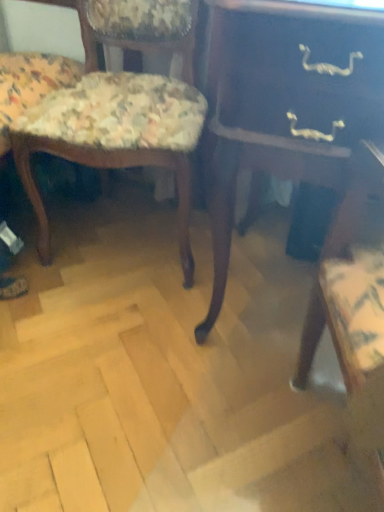
This screenshot has height=512, width=384. In order to click on free space that is to the left of dark wood table at center in this screenshot , I will do `click(115, 343)`.